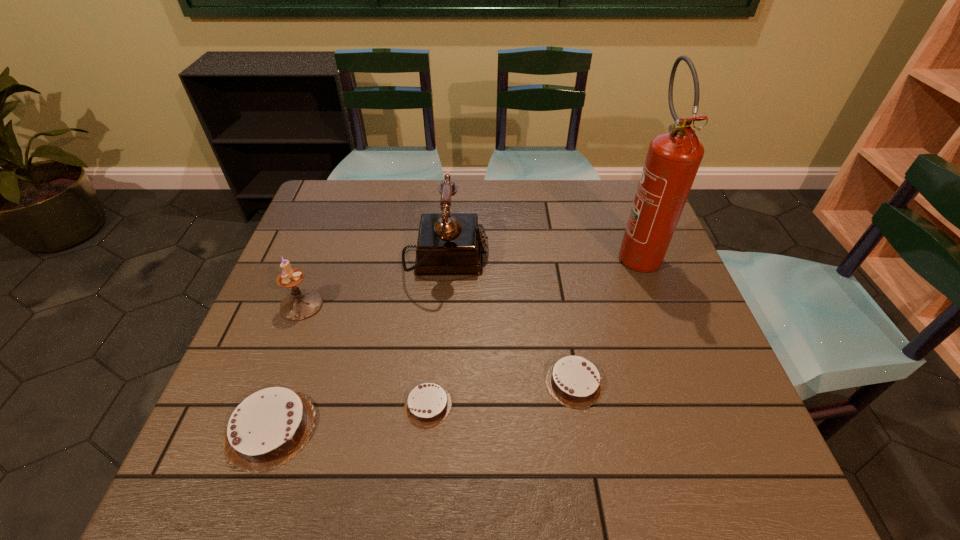
You are a GUI agent. You are given a task and a screenshot of the screen. Output one action in this format:
    pyautogui.click(x=<x>, y=<y>)
    Task: Click on the free space located 0.370m on the back of the leftmost chocolate cake
    This screenshot has height=540, width=960.
    Given the screenshot: What is the action you would take?
    pyautogui.click(x=327, y=268)

Image resolution: width=960 pixels, height=540 pixels. Identify the location of free space located 0.330m on the left of the shortest chocolate cake. (243, 404).

I want to click on free space located on the back of the rightmost chocolate cake, so click(x=561, y=305).

The width and height of the screenshot is (960, 540). Find the location of `vacant space located 0.160m on the dial of the fifth shortest object`. vacant space located 0.160m on the dial of the fifth shortest object is located at coordinates (547, 258).

Find the location of a particular element. vacant space located from the nozzle of the fire extinguisher is located at coordinates (689, 393).

Image resolution: width=960 pixels, height=540 pixels. I want to click on vacant space located 0.260m on the right of the candle holder, so click(x=427, y=305).

This screenshot has height=540, width=960. I want to click on chocolate cake located at the left edge, so click(x=269, y=427).

You are a GUI agent. You are given a task and a screenshot of the screen. Output one action in this format:
    pyautogui.click(x=<x>, y=<y>)
    Task: Click on the candle holder situated at the left edge
    
    Given the screenshot: What is the action you would take?
    (x=300, y=304)

The width and height of the screenshot is (960, 540). Identify the location of object positioned at the right edge. (673, 159).

Locate an element on the screen. Image resolution: width=960 pixels, height=540 pixels. object located in the near left corner section of the desktop is located at coordinates (269, 427).